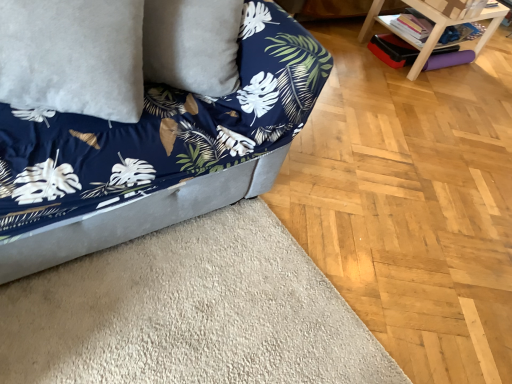
Question: From the image's perspective, is wooden table at upper right above velvet blue couch at lower left?

Choices:
 (A) no
 (B) yes

Answer: (B)

Question: Is wooden table at upper right looking in the opposite direction of velvet blue couch at lower left?

Choices:
 (A) yes
 (B) no

Answer: (B)

Question: From a real-world perspective, is wooden table at upper right physically above velvet blue couch at lower left?

Choices:
 (A) no
 (B) yes

Answer: (A)

Question: Considering the relative positions of wooden table at upper right and velvet blue couch at lower left in the image provided, is wooden table at upper right to the left of velvet blue couch at lower left from the viewer's perspective?

Choices:
 (A) yes
 (B) no

Answer: (B)

Question: Can you confirm if wooden table at upper right is wider than velvet blue couch at lower left?

Choices:
 (A) yes
 (B) no

Answer: (B)

Question: Are wooden table at upper right and velvet blue couch at lower left beside each other?

Choices:
 (A) yes
 (B) no

Answer: (B)

Question: Can you confirm if wooden table at upper right is taller than white fluffy pillow at upper left?

Choices:
 (A) no
 (B) yes

Answer: (A)

Question: From a real-world perspective, is wooden table at upper right located higher than white fluffy pillow at upper left?

Choices:
 (A) no
 (B) yes

Answer: (A)

Question: Is wooden table at upper right completely or partially outside of white fluffy pillow at upper left?

Choices:
 (A) yes
 (B) no

Answer: (A)

Question: From the image's perspective, is wooden table at upper right located beneath white fluffy pillow at upper left?

Choices:
 (A) yes
 (B) no

Answer: (B)

Question: Is wooden table at upper right further to camera compared to white fluffy pillow at upper left?

Choices:
 (A) yes
 (B) no

Answer: (A)

Question: Is wooden table at upper right closer to camera compared to white fluffy pillow at upper left?

Choices:
 (A) no
 (B) yes

Answer: (A)

Question: Does velvet blue couch at lower left have a lesser height compared to white fluffy pillow at upper left?

Choices:
 (A) yes
 (B) no

Answer: (B)